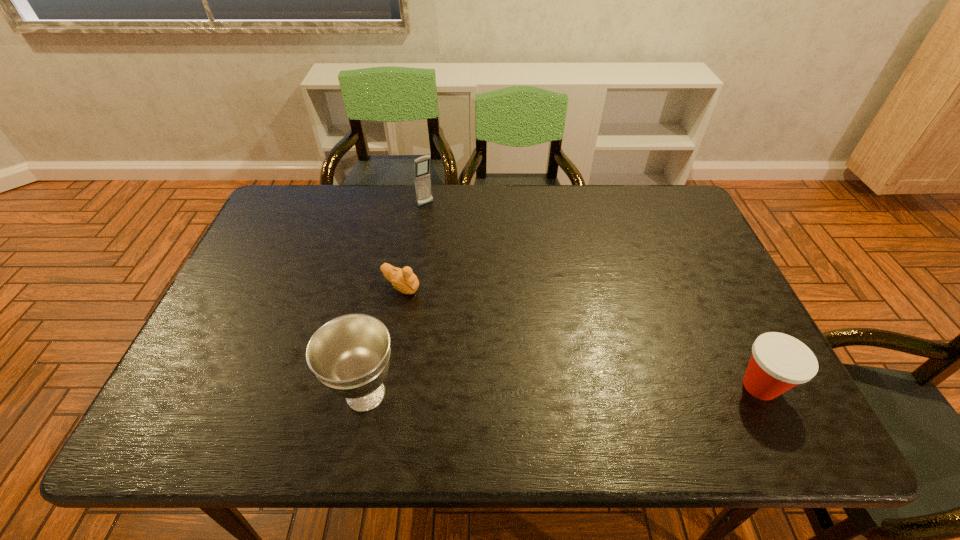
Identify the location of free space between the cellular telephone and the second shortest object. The width and height of the screenshot is (960, 540). (593, 295).

I want to click on empty space that is in between the Dixie cup and the second farthest object, so click(581, 336).

Where is `unoccupied position between the farthest object and the shortest object`? The image size is (960, 540). unoccupied position between the farthest object and the shortest object is located at coordinates click(414, 246).

Locate an element on the screen. vacant region between the chalice and the second shortest object is located at coordinates (563, 390).

The width and height of the screenshot is (960, 540). I want to click on free space between the farthest object and the third nearest object, so click(414, 246).

This screenshot has height=540, width=960. Find the location of `object identified as the second closest to the farthest object`. object identified as the second closest to the farthest object is located at coordinates (350, 355).

This screenshot has height=540, width=960. What are the coordinates of `object that is the second nearest to the chalice` in the screenshot? It's located at (422, 181).

Locate an element on the screen. free space that satisfies the following two spatial constraints: 1. on the back side of the chalice; 2. on the left side of the Dixie cup is located at coordinates [x=367, y=386].

Find the location of a particular element. Image resolution: width=960 pixels, height=540 pixels. free space in the image that satisfies the following two spatial constraints: 1. on the back side of the chalice; 2. on the right side of the shortest object is located at coordinates (387, 287).

Where is `free space in the image that satisfies the following two spatial constraints: 1. on the front side of the rightmost object; 2. on the left side of the cellular telephone`? The height and width of the screenshot is (540, 960). free space in the image that satisfies the following two spatial constraints: 1. on the front side of the rightmost object; 2. on the left side of the cellular telephone is located at coordinates pos(400,386).